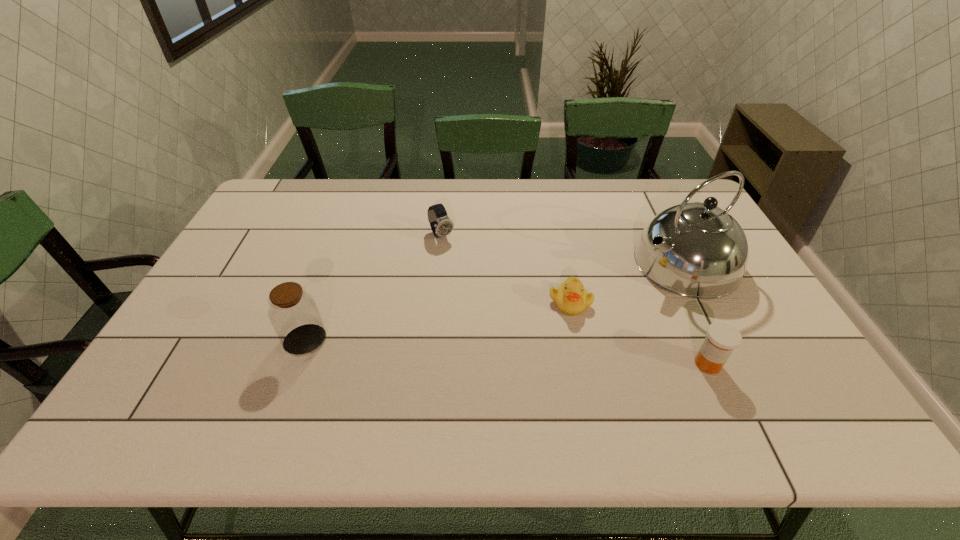
Locate an element on the screen. The image size is (960, 540). blank space located 0.250m on the label of the medicine is located at coordinates (588, 364).

This screenshot has width=960, height=540. Find the location of `vacant space located on the beak of the duckling`. vacant space located on the beak of the duckling is located at coordinates (475, 389).

In order to click on blank area located 0.210m on the beak of the duckling in this screenshot , I will do `click(507, 360)`.

I want to click on vacant space positioned on the beak of the duckling, so click(491, 375).

This screenshot has width=960, height=540. Find the location of `free region located on the face of the watch`. free region located on the face of the watch is located at coordinates (460, 261).

You are a GUI agent. You are given a task and a screenshot of the screen. Output one action in this format:
    pyautogui.click(x=<x>, y=<y>)
    Task: Click on the free region located 0.270m on the face of the watch
    
    Given the screenshot: What is the action you would take?
    pyautogui.click(x=490, y=298)

I want to click on vacant space located 0.340m on the face of the watch, so click(503, 315).

The height and width of the screenshot is (540, 960). Identify the location of free space located 0.130m from the spout of the tallest object. (610, 295).

Find the location of a particular element. This screenshot has height=540, width=960. vacant area situated from the spout of the tallest object is located at coordinates (553, 319).

Locate an element on the screen. This screenshot has height=540, width=960. free space located 0.360m from the spout of the tallest object is located at coordinates (540, 325).